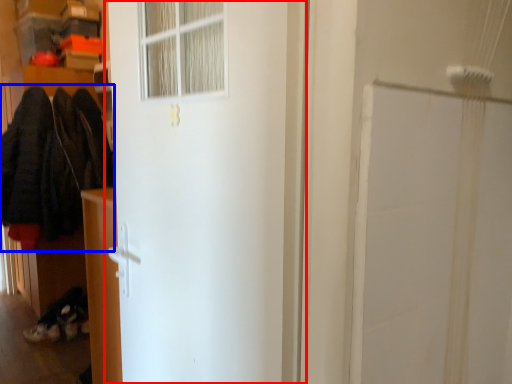
Question: Which point is further to the camera, door (highlighted by a red box) or clothing (highlighted by a blue box)?

Choices:
 (A) door
 (B) clothing

Answer: (B)